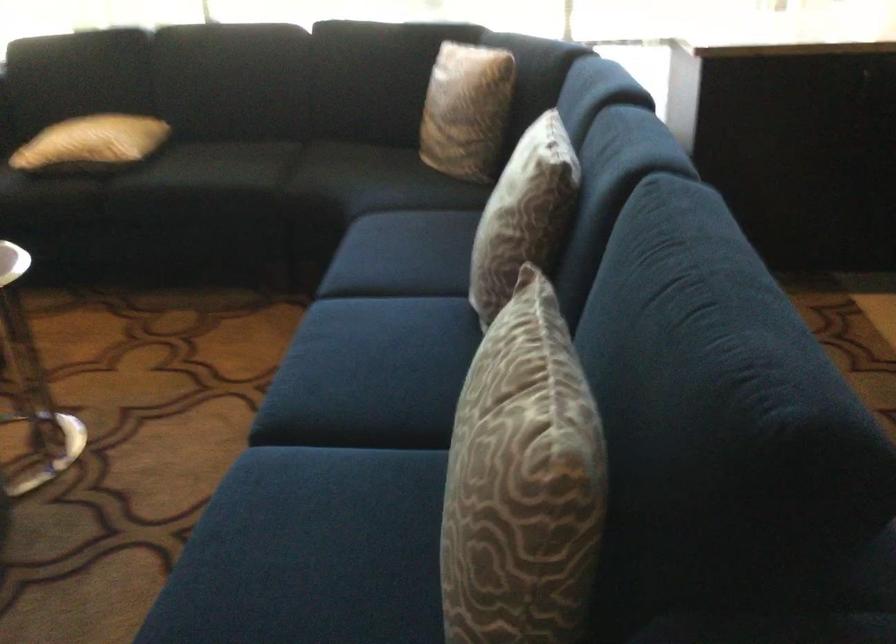
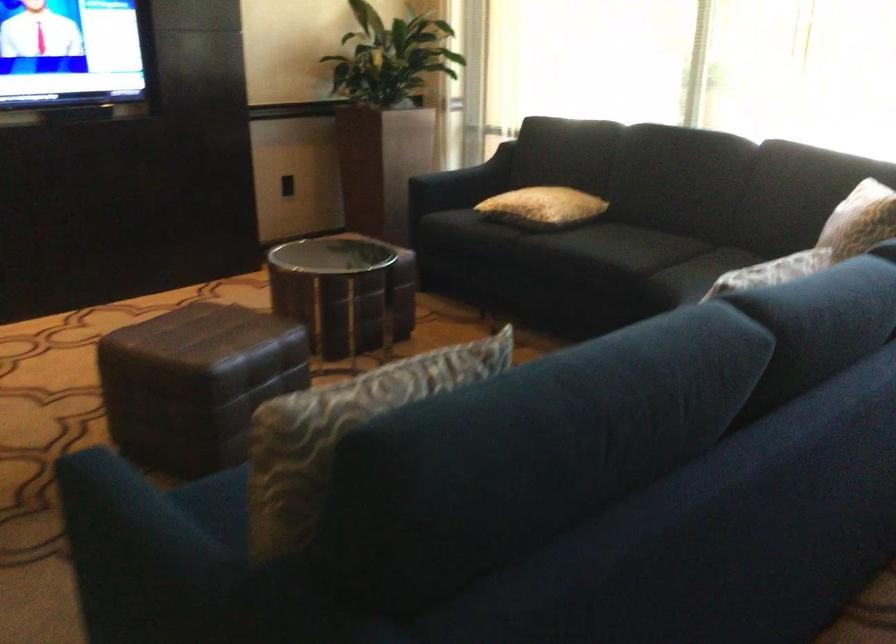
Where in the second image is the point corresponding to [247,174] from the first image?

(626, 254)